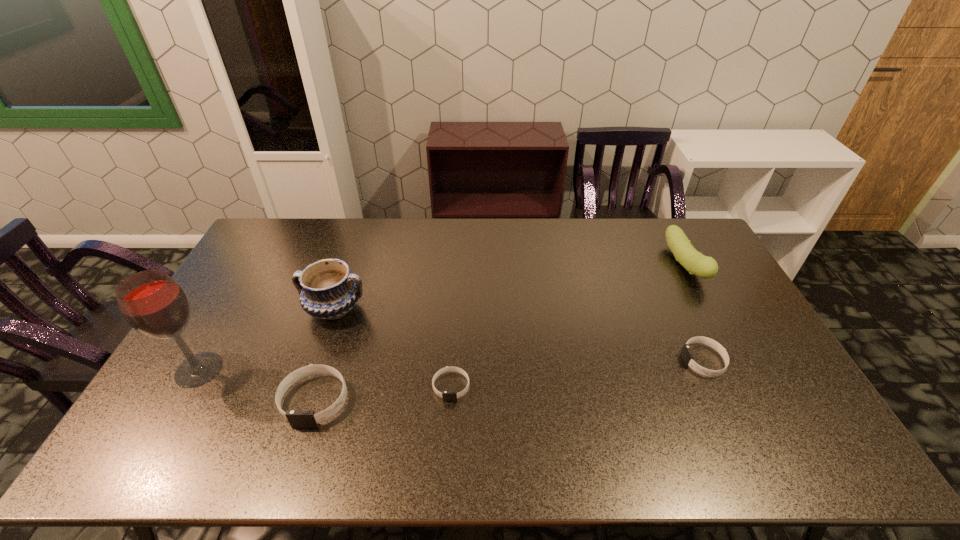
Identify the location of free spot between the fifth tallest object and the pottery. (519, 335).

Identify the location of free space between the pottery and the third tallest object. 510,286.

Locate an element on the screen. This screenshot has height=540, width=960. vacant space in between the cucumber and the second tallest object is located at coordinates (510, 286).

Find the location of a particular element. vacant space that's between the second tallest object and the tallest wristband is located at coordinates (324, 355).

Find the location of a particular element. free space between the rightmost wristband and the fourth shortest object is located at coordinates (694, 312).

Find the location of a particular element. empty space that is in between the second shortest wristband and the tallest wristband is located at coordinates (509, 381).

Image resolution: width=960 pixels, height=540 pixels. In order to click on free spot between the fourth tallest object and the pottery in this screenshot , I will do `click(324, 355)`.

Choose which object is the third nearest neighbor to the third tallest object. Please provide its 2D coordinates. Your answer should be formatted as a tuple, i.e. [(x, y)], where the tuple contains the x and y coordinates of a point satisfying the conditions above.

[(327, 290)]

You are a GUI agent. You are given a task and a screenshot of the screen. Output one action in this format:
    pyautogui.click(x=<x>, y=<y>)
    Task: Click on the object that is the second closest one to the shortest object
    Image resolution: width=960 pixels, height=540 pixels.
    Given the screenshot: What is the action you would take?
    (327, 290)

Point out which wristband is positioned as the second nearest to the tallest object. Please provide its 2D coordinates. Your answer should be formatted as a tuple, i.e. [(x, y)], where the tuple contains the x and y coordinates of a point satisfying the conditions above.

[(446, 395)]